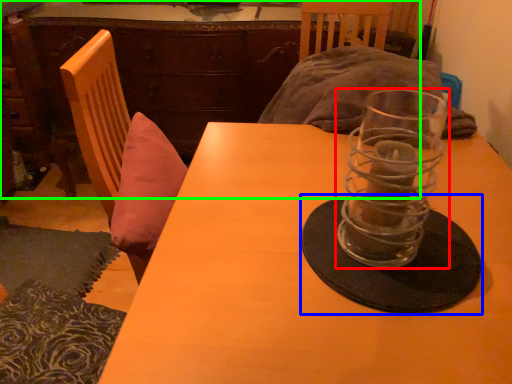
Question: Which object is positioned closest to tableware (highlighted by a red box)? Select from glass plate (highlighted by a blue box) and dresser (highlighted by a green box).

Choices:
 (A) glass plate
 (B) dresser

Answer: (A)